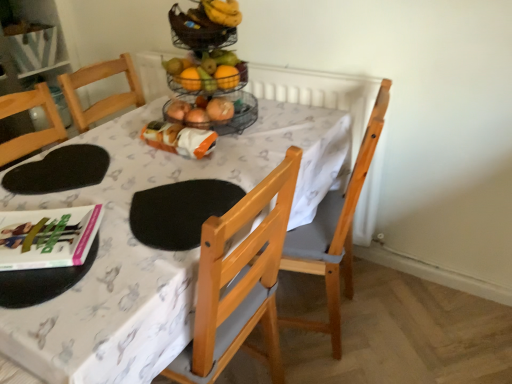
The width and height of the screenshot is (512, 384). In order to click on vacant area that lies to the right of orange plastic bag at center in this screenshot , I will do `click(250, 147)`.